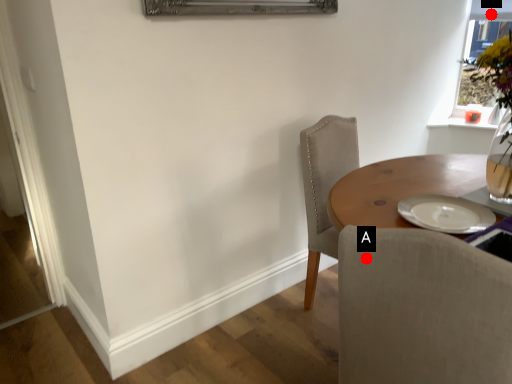
Question: Two points are circled on the image, labeled by A and B beside each circle. Which point is closer to the camera?

Choices:
 (A) A is closer
 (B) B is closer

Answer: (A)